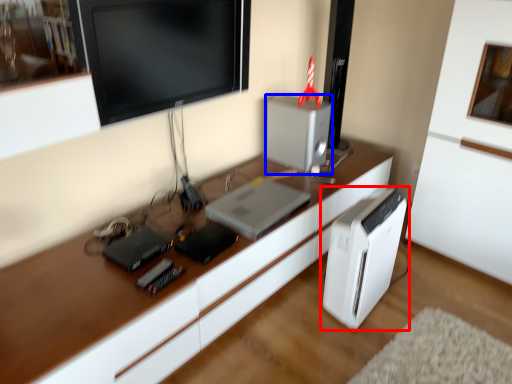
Question: Which object is closer to the camera taking this photo, home appliance (highlighted by a red box) or appliance (highlighted by a blue box)?

Choices:
 (A) home appliance
 (B) appliance

Answer: (A)